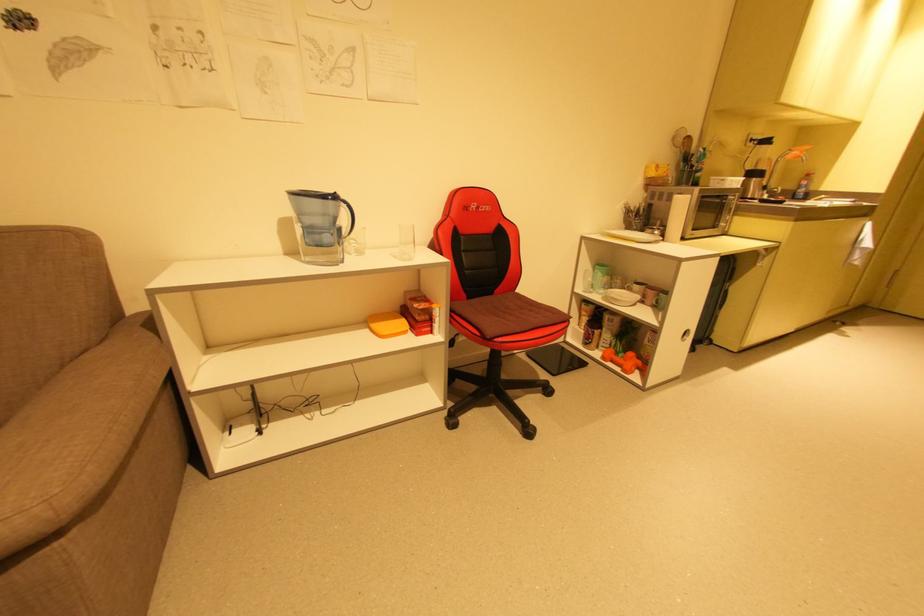
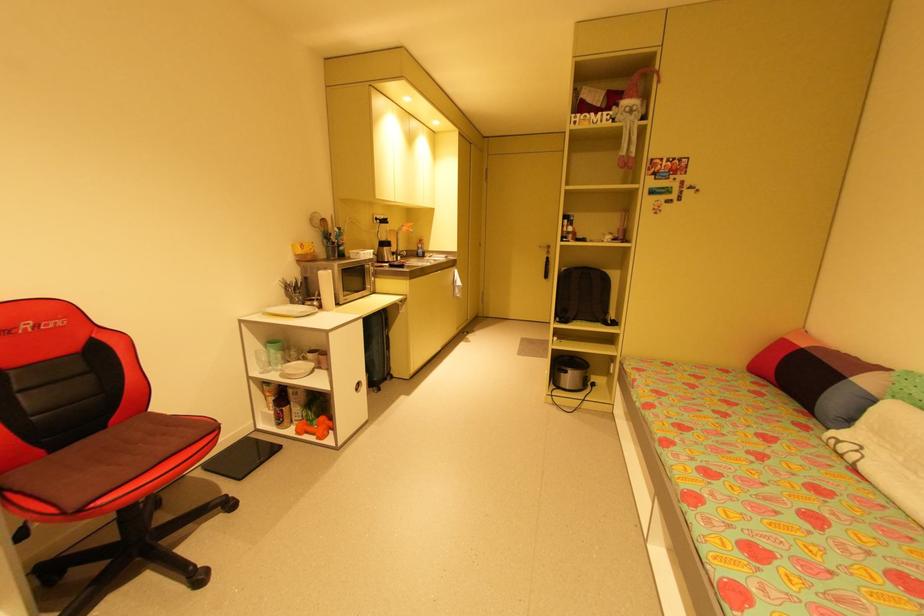
Question: The first image is from the beginning of the video and the second image is from the end. How did the camera likely rotate when shooting the video?

Choices:
 (A) Left
 (B) Right
 (C) Up
 (D) Down

Answer: (B)